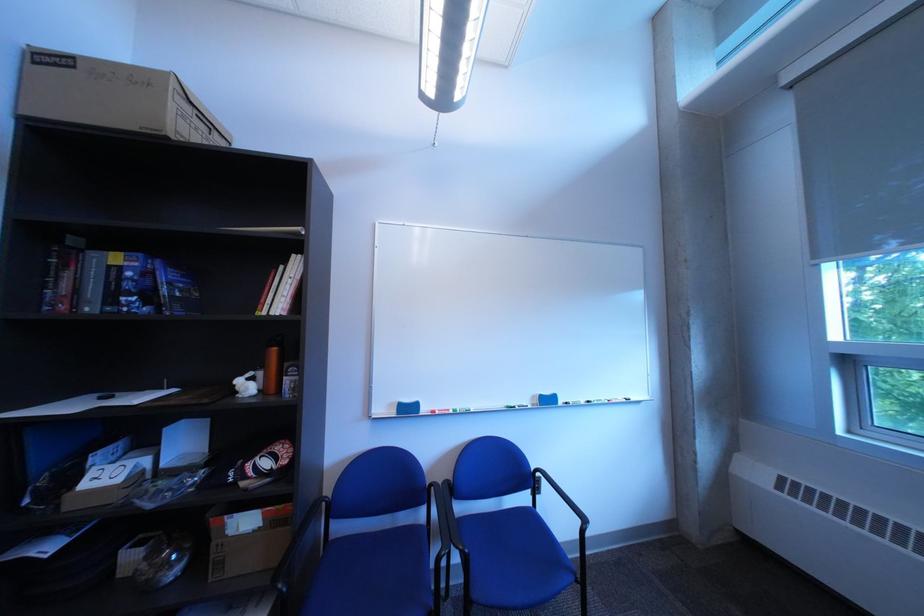
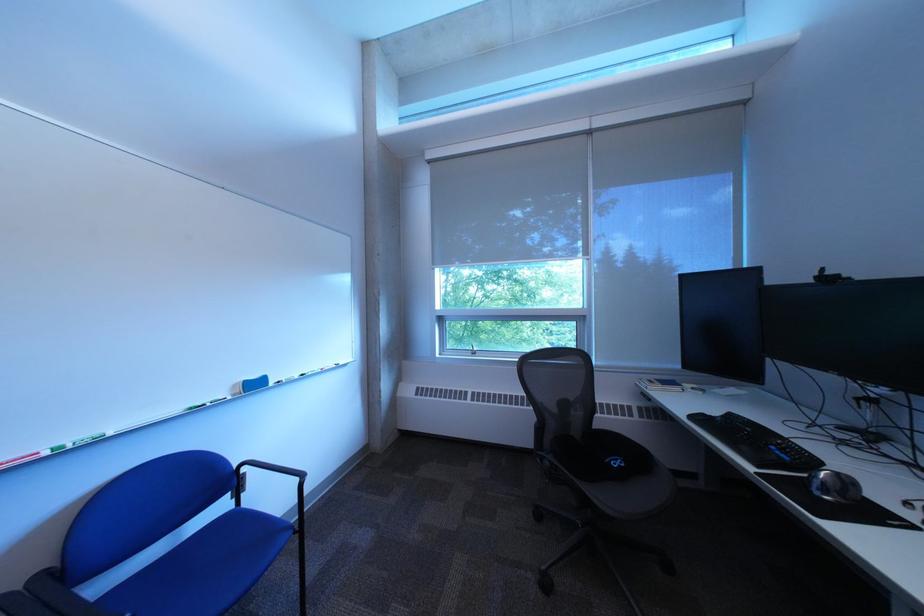
Locate, in the second image, the point that corresponds to point 553,472 in the first image.

(257, 467)